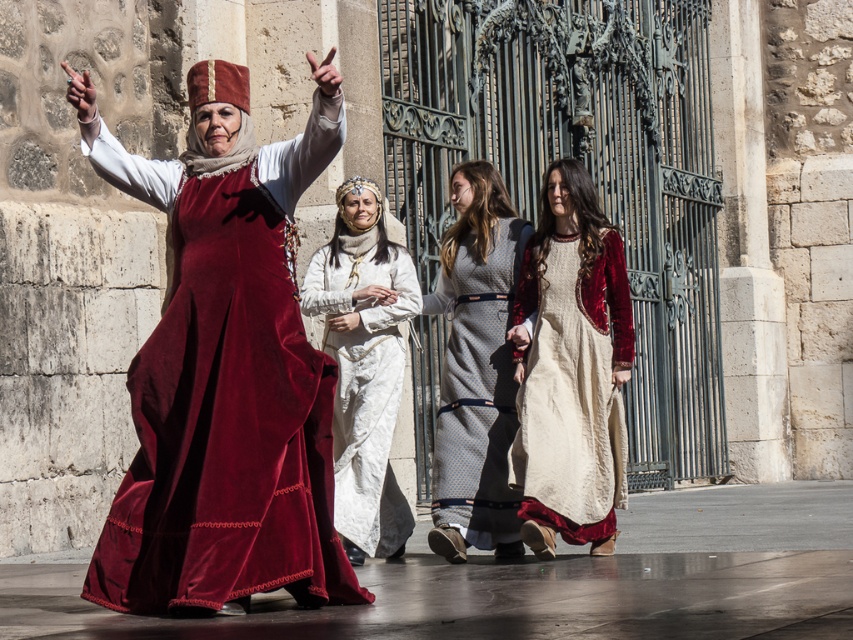
Which of these two, velvet dress at left or white silk dress at center, stands taller?

With more height is velvet dress at left.

Is velvet dress at left positioned in front of white silk dress at center?

That is True.

Is point (213, 336) less distant than point (345, 548)?

Yes, point (213, 336) is closer to viewer.

Image resolution: width=853 pixels, height=640 pixels. Find the location of `velvet dress at left`. velvet dress at left is located at coordinates (225, 426).

Is velvet beige dress at center behind velvet gray dress at center?

No, velvet beige dress at center is in front of velvet gray dress at center.

In the scene shown: Does velvet beige dress at center appear under velvet gray dress at center?

Yes, velvet beige dress at center is below velvet gray dress at center.

The width and height of the screenshot is (853, 640). In order to click on velvet beige dress at center in this screenshot , I will do (x=572, y=371).

Who is lower down, velvet gray dress at center or white silk dress at center?

Positioned lower is velvet gray dress at center.

Between velvet gray dress at center and white silk dress at center, which one has less height?

white silk dress at center is shorter.

Which is in front, point (468, 360) or point (380, 513)?

Positioned in front is point (380, 513).

Where is `velvet gray dress at center`? This screenshot has height=640, width=853. velvet gray dress at center is located at coordinates (476, 369).